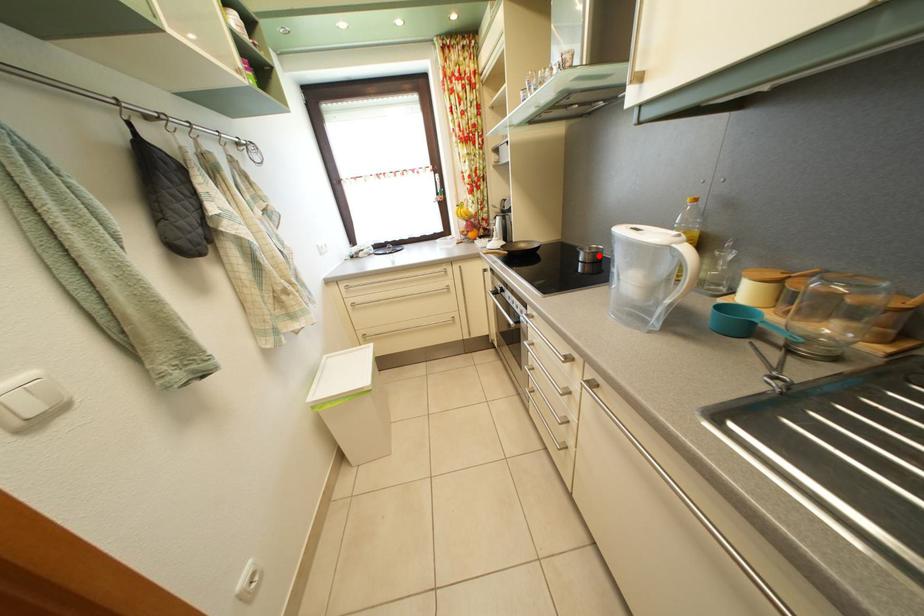
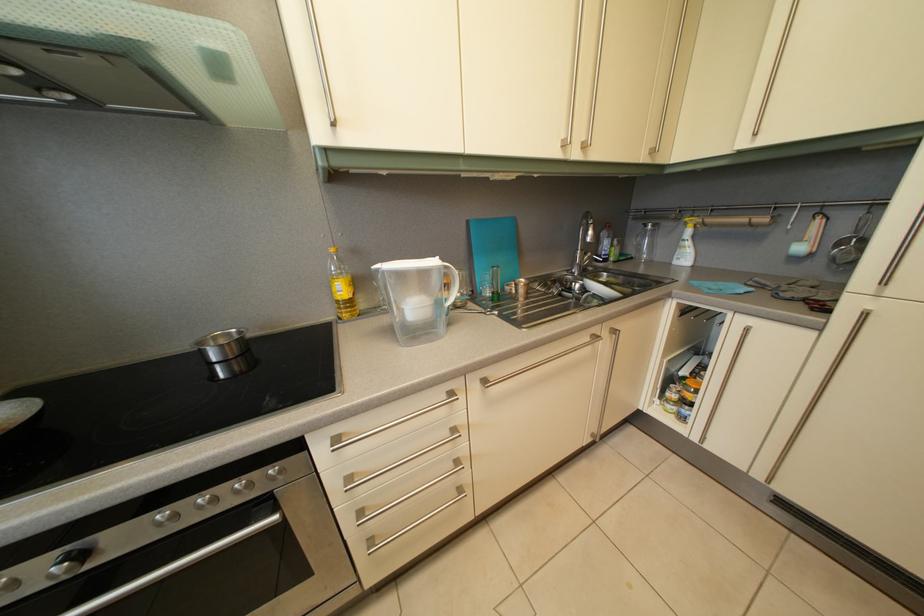
Where in the second image is the point corresponding to the highlighted location from the first image?

(224, 346)